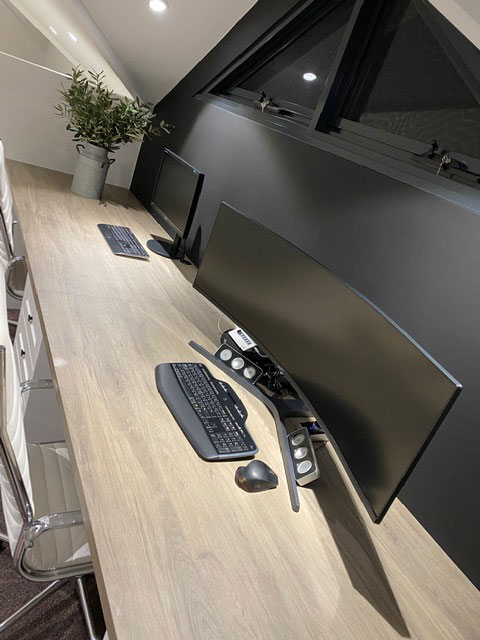
This screenshot has width=480, height=640. Identify the location of good stereo speakers. (302, 454), (233, 365).